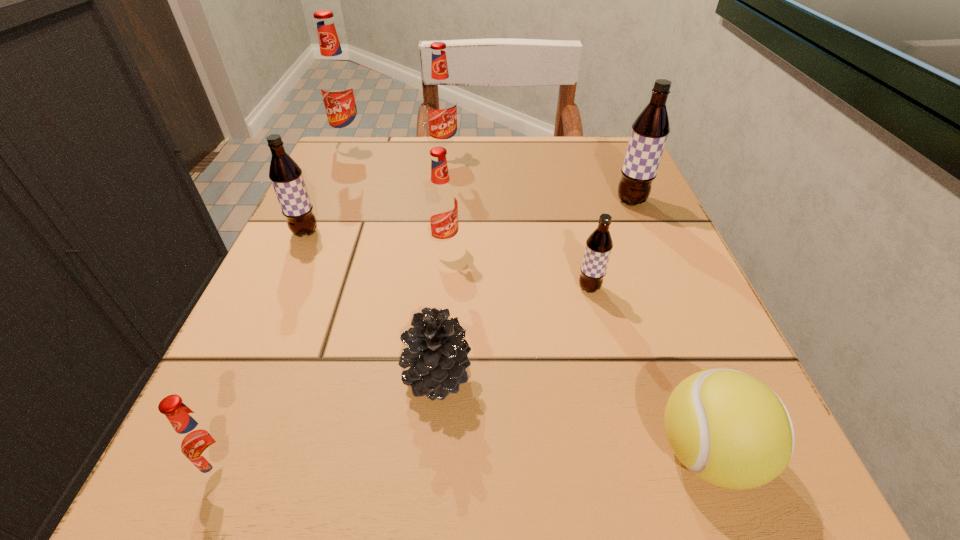
You are a GUI agent. You are given a task and a screenshot of the screen. Output one action in this format:
    pyautogui.click(x=<x>, y=<y>)
    Task: Click on the vacant area situated on the right of the nearest red root beer
    
    Given the screenshot: What is the action you would take?
    pyautogui.click(x=372, y=468)

At what (x,y) coordinates should I click in order to perform the action: click on vacant space located 0.220m on the back of the pinecone. Please return your answer as a coordinate pair (x, y). Looking at the image, I should click on (447, 244).

Where is `free region located 0.240m on the back of the yellow tennis ball`? The width and height of the screenshot is (960, 540). free region located 0.240m on the back of the yellow tennis ball is located at coordinates (637, 271).

Identify the location of root beer positioned at the near edge. (202, 441).

Image resolution: width=960 pixels, height=540 pixels. I want to click on tennis ball that is at the near edge, so click(728, 428).

Locate an element on the screen. tennis ball that is at the right edge is located at coordinates (728, 428).

Locate an element on the screen. The image size is (960, 540). object that is at the far left corner is located at coordinates (338, 86).

Find the location of a particular element. The image size is (960, 540). object located at the near left corner is located at coordinates (202, 441).

The width and height of the screenshot is (960, 540). Find the location of `object located in the far right corner section of the desktop`. object located in the far right corner section of the desktop is located at coordinates (650, 130).

The width and height of the screenshot is (960, 540). In order to click on object located at the near right corner in this screenshot , I will do `click(728, 428)`.